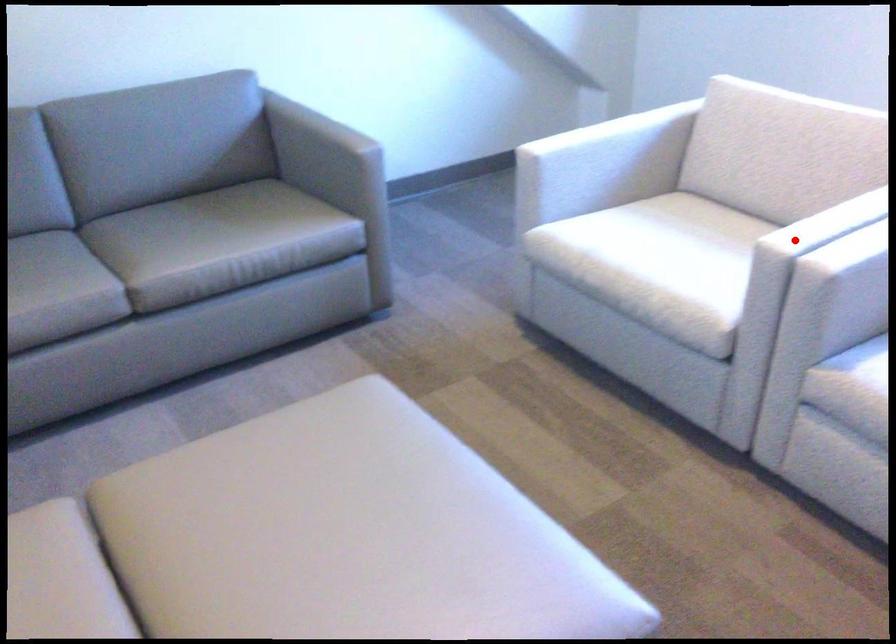
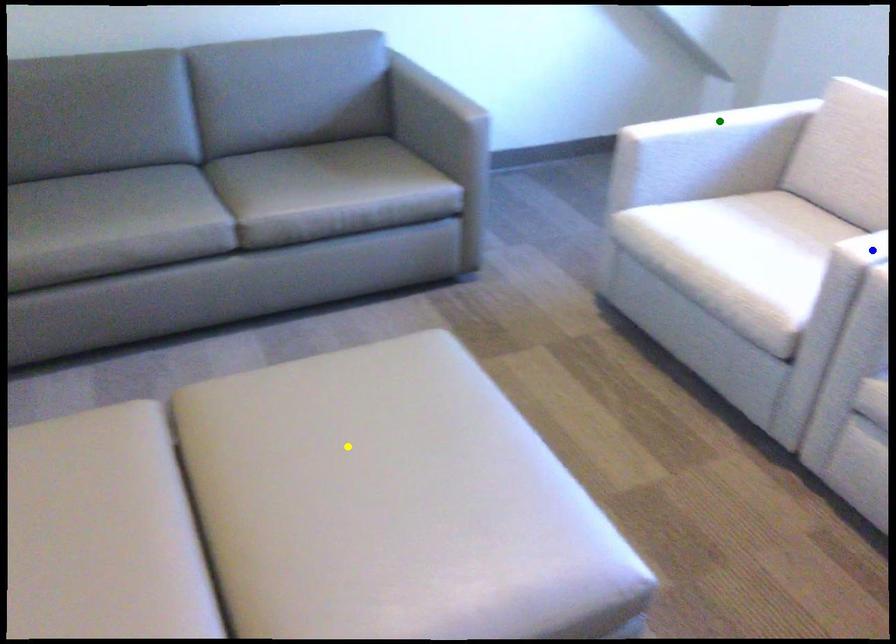
Question: I am providing you with two images of the same scene from different viewpoints. A red point is marked on the first image. You are given multiple points on the second image. Which spot in image 2 lines up with the point in image 1?

Choices:
 (A) yellow point
 (B) blue point
 (C) green point

Answer: (B)